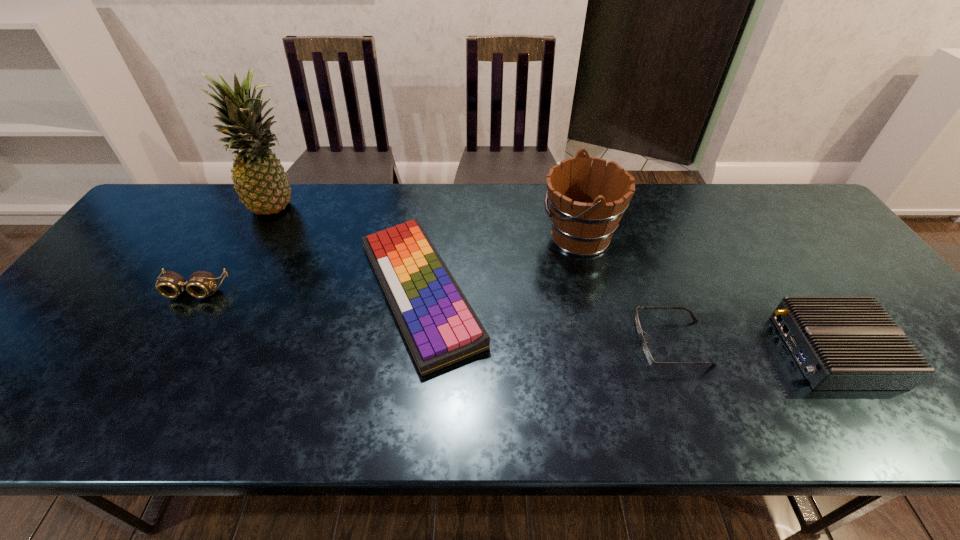
Find the location of a particular element. the tallest object is located at coordinates (259, 178).

The height and width of the screenshot is (540, 960). In order to click on the second tallest object in this screenshot , I will do `click(587, 202)`.

At what (x,y) coordinates should I click in order to perform the action: click on the third tallest object. Please return your answer as a coordinate pair (x, y). Image resolution: width=960 pixels, height=540 pixels. Looking at the image, I should click on (840, 343).

Locate an element on the screen. the rightmost object is located at coordinates (840, 343).

I want to click on the third shortest object, so click(171, 285).

The image size is (960, 540). What are the coordinates of `the third object from left to right` in the screenshot? It's located at (440, 327).

Locate an element on the screen. computer keyboard is located at coordinates (440, 327).

Locate an element on the screen. This screenshot has width=960, height=540. spectacles is located at coordinates (648, 355).

Where is `free space located on the left of the pineapple`? free space located on the left of the pineapple is located at coordinates (206, 205).

You are a GUI agent. You are given a task and a screenshot of the screen. Output one action in this format:
    pyautogui.click(x=<x>, y=<y>)
    Task: Click on the blank space located 0.050m with the handle on the wine bucket
    Image resolution: width=960 pixels, height=540 pixels.
    Given the screenshot: What is the action you would take?
    pyautogui.click(x=522, y=237)